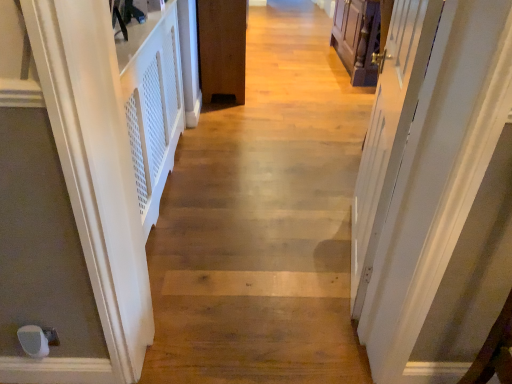
Question: From the image's perspective, relative to white matte door at left, the 1th door viewed from the left, is natural wood floor at center above or below?

Choices:
 (A) below
 (B) above

Answer: (B)

Question: Looking at their shapes, would you say natural wood floor at center is wider or thinner than white matte door at left, the 1th door viewed from the left?

Choices:
 (A) wide
 (B) thin

Answer: (A)

Question: Which is farther from the natural wood floor at center?

Choices:
 (A) white matte door at left, marked as the second door in a back-to-front arrangement
 (B) brown matte door at center, the first door when ordered from right to left
 (C) white glossy door at right

Answer: (A)

Question: Which object is positioned farthest from the white glossy door at right?

Choices:
 (A) white matte door at left, placed as the first door when sorted from front to back
 (B) brown matte door at center, the 2th door when ordered from left to right
 (C) natural wood floor at center

Answer: (B)